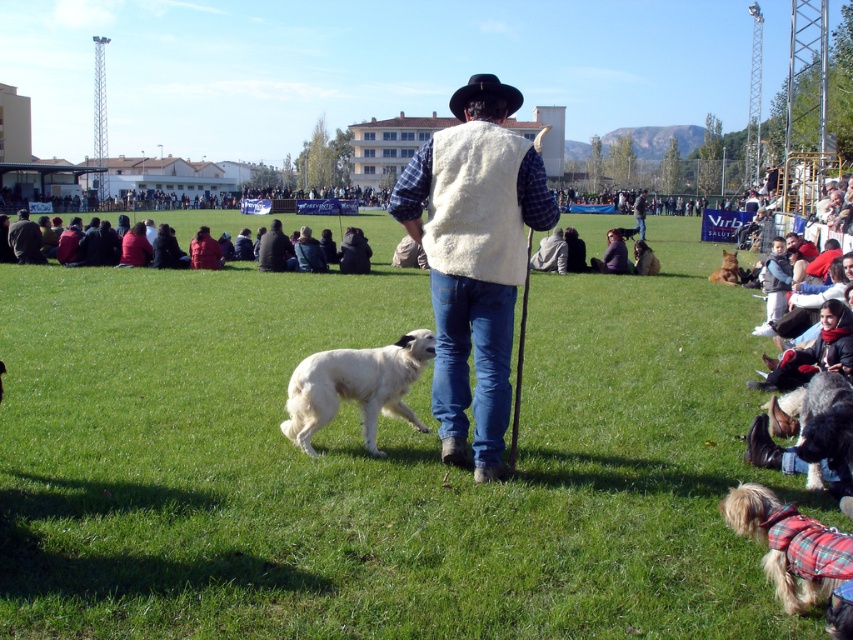
You are a photographer at the event and want to capture a photo of the white fleece vest at center without the green grass at center showing in the background. Is this possible based on their positions?

The green grass at center is positioned under the white fleece vest at center, so it is possible to focus on the white fleece vest at center while keeping the green grass at center out of the frame by adjusting the camera angle or focusing on the upper part of the vest.

You are standing at the edge of the field and see the green grass at center and the white fluffy dog at center. If you want to approach the dog, should you walk to your left or right from the grass?

The green grass at center is to the left of white fluffy dog at center, so to approach the dog from the grass, you should walk to your right.